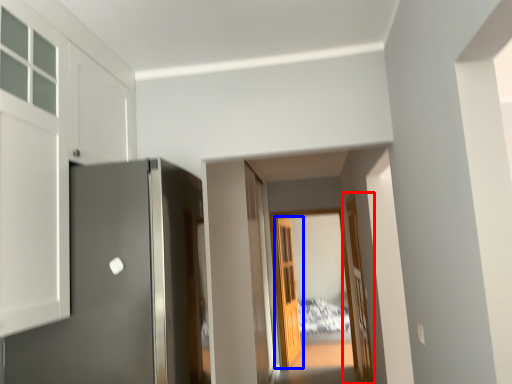
Question: Which point is further to the camera, door (highlighted by a red box) or door (highlighted by a blue box)?

Choices:
 (A) door
 (B) door

Answer: (B)